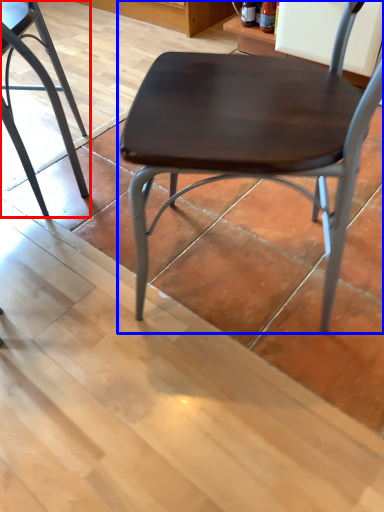
Question: Which object appears closest to the camera in this image, chair (highlighted by a red box) or chair (highlighted by a blue box)?

Choices:
 (A) chair
 (B) chair

Answer: (B)